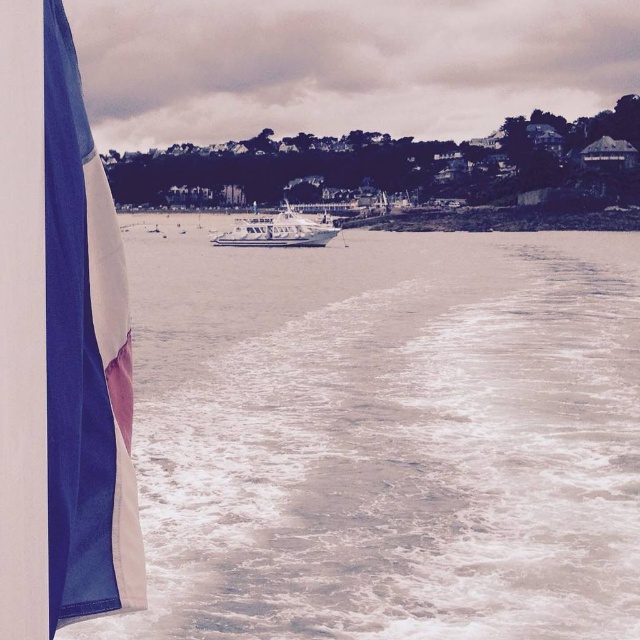
Question: Estimate the real-world distances between objects in this image. Which object is farther from the white frothy water at lower center?

Choices:
 (A) white matte boat at center
 (B) blue fabric flag at left

Answer: (B)

Question: Is blue fabric flag at left to the right of white matte boat at center from the viewer's perspective?

Choices:
 (A) no
 (B) yes

Answer: (B)

Question: Is white frothy water at lower center positioned in front of blue fabric flag at left?

Choices:
 (A) no
 (B) yes

Answer: (A)

Question: Among these points, which one is farthest from the camera?

Choices:
 (A) (160, 493)
 (B) (109, 467)

Answer: (A)

Question: Which point is closer to the camera taking this photo?

Choices:
 (A) (70, 202)
 (B) (317, 241)
 (C) (148, 484)

Answer: (A)

Question: Can you confirm if blue fabric flag at left is positioned above white matte boat at center?

Choices:
 (A) yes
 (B) no

Answer: (B)